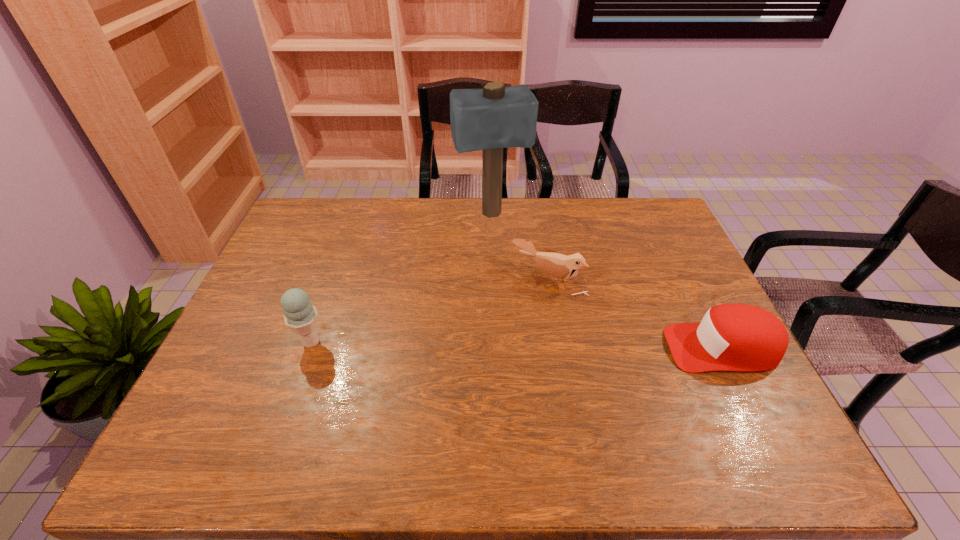
This screenshot has width=960, height=540. I want to click on empty space that is in between the second tallest object and the rightmost object, so click(516, 345).

Find the location of a particular element. object that can be found as the closest to the rightmost object is located at coordinates (556, 265).

You are a GUI agent. You are given a task and a screenshot of the screen. Output one action in this format:
    pyautogui.click(x=<x>, y=<y>)
    Task: Click on the third closest object to the leftmost object
    
    Given the screenshot: What is the action you would take?
    pyautogui.click(x=731, y=337)

This screenshot has height=540, width=960. I want to click on blank area in the image that satisfies the following two spatial constraints: 1. on the front side of the farthest object; 2. on the front-facing side of the rightmost object, so click(x=494, y=348).

Where is `free space in the image that satisfies the following two spatial constraints: 1. on the front side of the farthest object; 2. on the front-facing side of the baseball cap`? free space in the image that satisfies the following two spatial constraints: 1. on the front side of the farthest object; 2. on the front-facing side of the baseball cap is located at coordinates (494, 348).